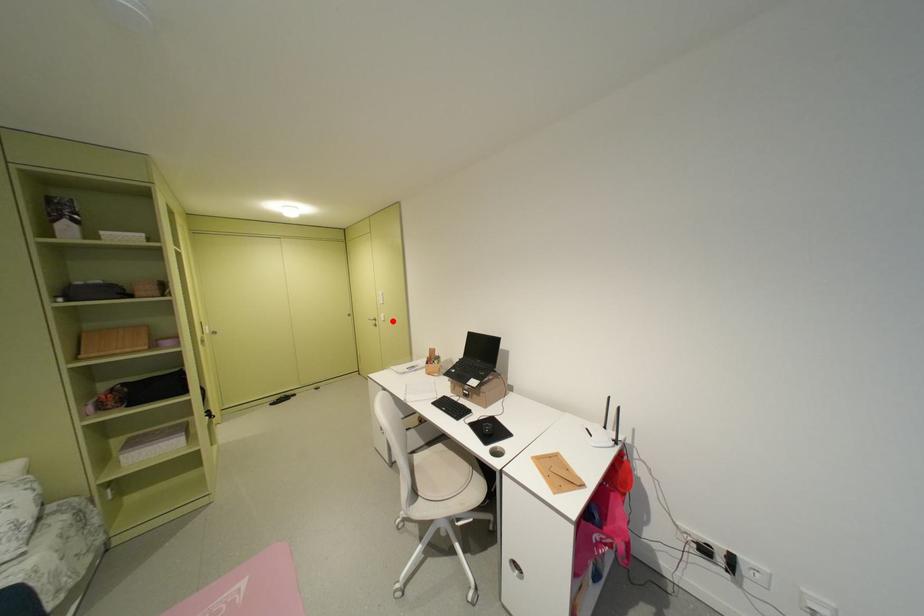
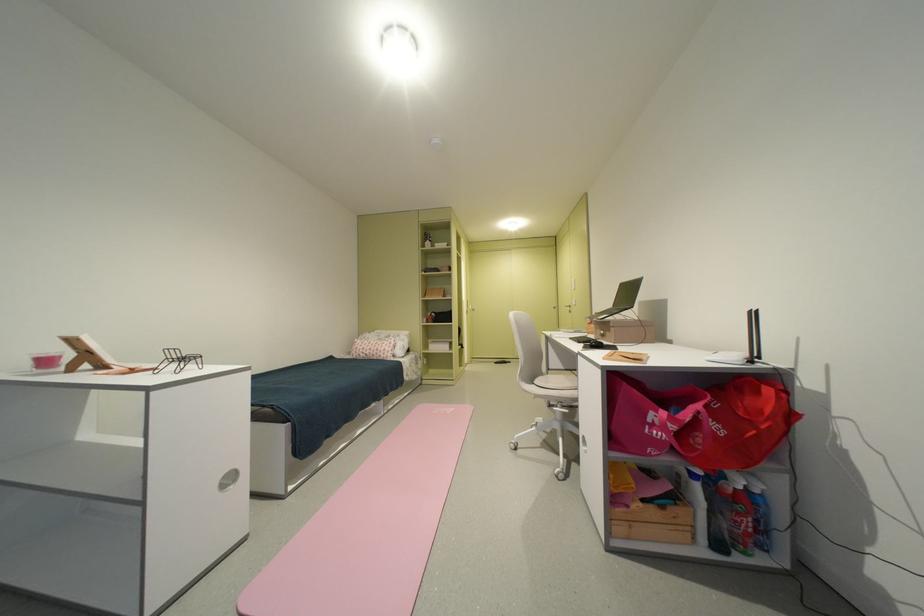
The point at the highlighted location is marked in the first image. Where is the corresponding point in the second image?

(584, 305)